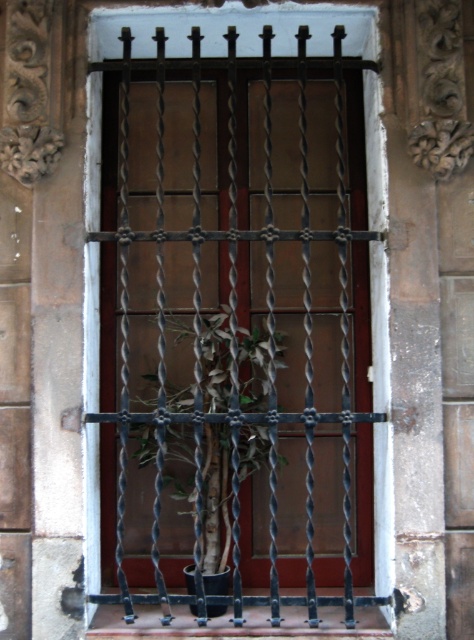
Question: Does black wrought iron bars at center appear on the left side of smooth concrete window sill at center?

Choices:
 (A) yes
 (B) no

Answer: (A)

Question: Which object appears farthest from the camera in this image?

Choices:
 (A) smooth concrete window sill at center
 (B) black wrought iron bars at center

Answer: (A)

Question: Can you confirm if green leafy plant at center is positioned to the right of smooth concrete window sill at center?

Choices:
 (A) yes
 (B) no

Answer: (B)

Question: Can you confirm if green leafy plant at center is positioned below smooth concrete window sill at center?

Choices:
 (A) no
 (B) yes

Answer: (A)

Question: Which of the following is the farthest from the observer?

Choices:
 (A) (189, 474)
 (B) (358, 616)
 (C) (260, 339)

Answer: (A)

Question: Among these points, which one is farthest from the camera?

Choices:
 (A) (106, 604)
 (B) (202, 516)

Answer: (B)